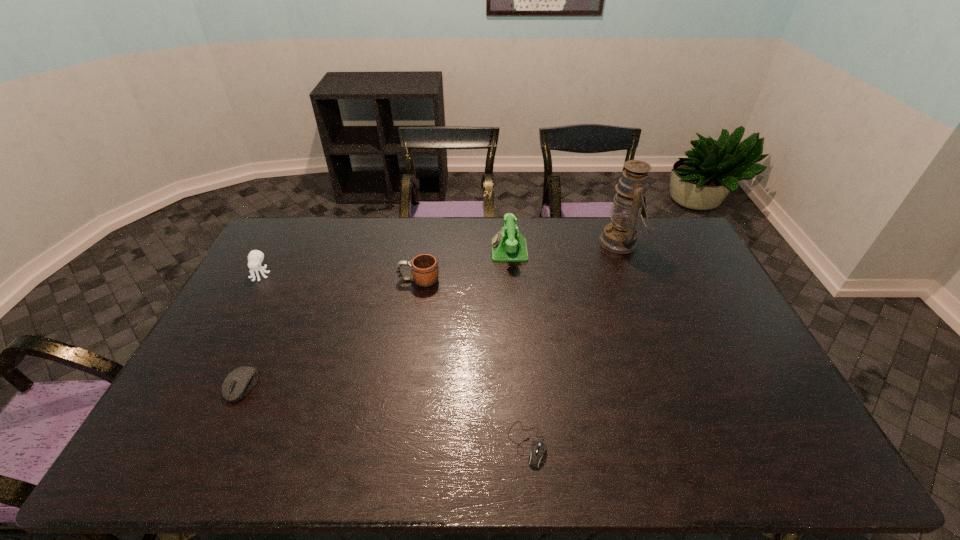
The height and width of the screenshot is (540, 960). I want to click on telephone that is at the far edge, so click(x=508, y=245).

Locate an element on the screen. The width and height of the screenshot is (960, 540). object that is at the near edge is located at coordinates (535, 459).

This screenshot has width=960, height=540. I want to click on octopus positioned at the left edge, so click(255, 257).

Find the location of a particular element. The width and height of the screenshot is (960, 540). computer equipment located at the left edge is located at coordinates (239, 382).

This screenshot has width=960, height=540. What are the coordinates of `vacant area at the far edge` in the screenshot? It's located at (546, 246).

What are the coordinates of `vacant space at the near edge of the desktop` in the screenshot? It's located at (400, 438).

In order to click on vacant area at the right edge in this screenshot , I will do `click(725, 406)`.

In the image, there is a desktop. Where is `free space at the far left corner`? The width and height of the screenshot is (960, 540). free space at the far left corner is located at coordinates (290, 239).

Image resolution: width=960 pixels, height=540 pixels. I want to click on vacant space at the far right corner of the desktop, so click(659, 226).

This screenshot has height=540, width=960. What are the coordinates of `free space that is in between the nearest object and the leftmost object` in the screenshot? It's located at (394, 359).